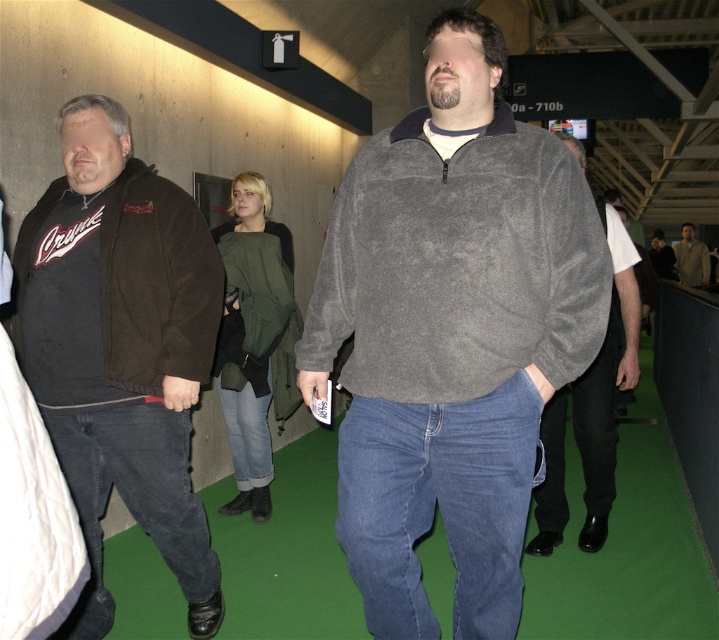
You are a photographer trying to capture a candid shot of the two people in the scene. The gray suede sweatshirt at center and the light beige sweater at right are both in your viewfinder. Based on their heights, which one might you need to adjust your camera angle upwards to focus on?

The light beige sweater at right is taller than the gray suede sweatshirt at center, so you would need to adjust your camera angle upwards to focus on the light beige sweater at right.

You are a photographer trying to capture a candid shot of the two men in the center of the image. Since you want to focus on their clothing details, you need to know which of their lower body garments is narrower. Which one is narrower between the blue denim jeans at center and the gray fleece sweater at center?

The blue denim jeans at center has a lesser width compared to the gray fleece sweater at center, so the blue denim jeans at center is narrower.